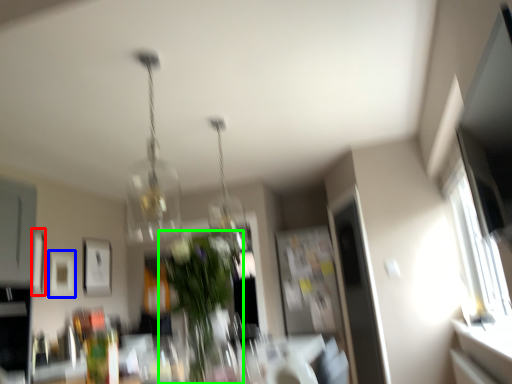
Question: Estimate the real-world distances between objects in this image. Which object is farther from picture frame (highlighted by a red box), picture frame (highlighted by a blue box) or houseplant (highlighted by a green box)?

Choices:
 (A) picture frame
 (B) houseplant

Answer: (B)